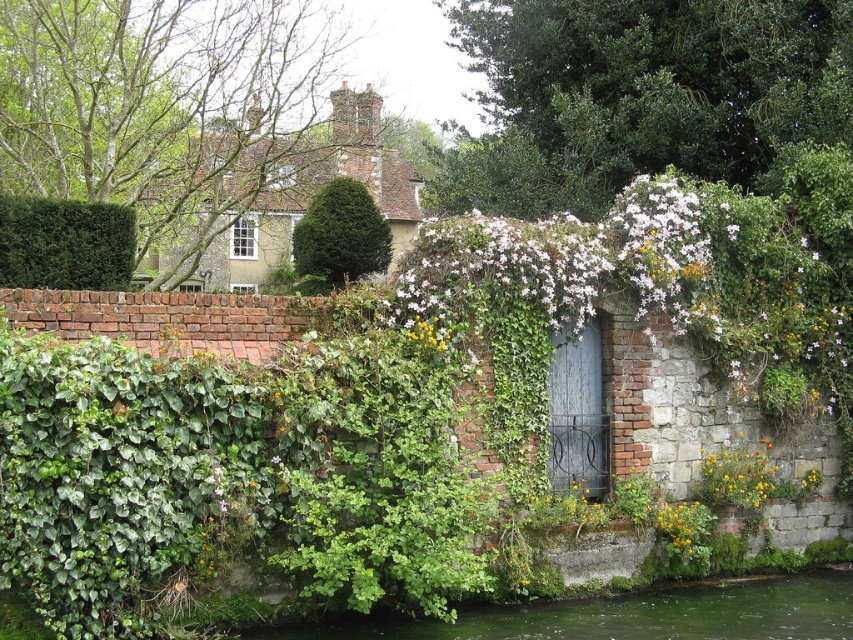
You are an artist planning to paint this scene. You want to ensure the green leafy bush at upper left and the yellow matte flower at lower center are proportionally accurate. Which object should you paint larger in your artwork?

The green leafy bush at upper left should be painted larger than the yellow matte flower at lower center because it is described as larger in size.

You are standing in front of the brick wall and want to take a photo of the green leafy bush at upper left and the green textured hedge at center. Which one will appear closer to the camera in the photo?

The green leafy bush at upper left will appear closer to the camera in the photo because it is positioned in front of the green textured hedge at center.

You are an artist planning to paint this scene. You need to decide which object to focus on first based on their sizes. Which one should you paint first, the white matte flowers at center or the green leafy bush at upper left?

The white matte flowers at center is bigger than the green leafy bush at upper left, so you should paint the white matte flowers at center first to ensure proper scaling when adding smaller details later.